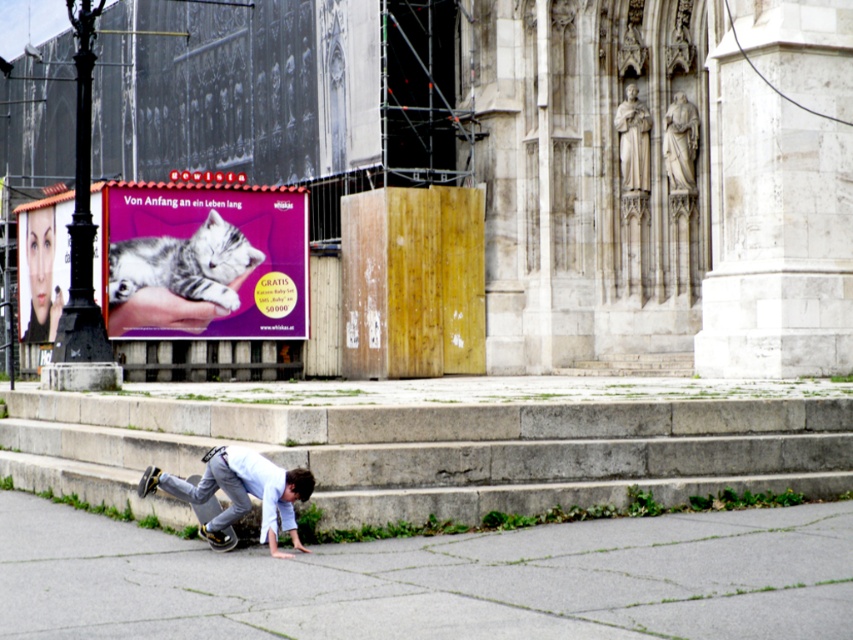
Which is behind, point (421, 460) or point (281, 502)?

Positioned behind is point (421, 460).

Who is lower down, concrete stairs at lower center or light blue denim squat at lower center?

light blue denim squat at lower center

Describe the element at coordinates (436, 451) in the screenshot. I see `concrete stairs at lower center` at that location.

At what (x,y) coordinates should I click in order to perform the action: click on concrete stairs at lower center. Please return your answer as a coordinate pair (x, y). The width and height of the screenshot is (853, 640). Looking at the image, I should click on (436, 451).

Is gray concrete pavement at lower left wider than light blue denim squat at lower center?

Yes.

Who is taller, gray concrete pavement at lower left or light blue denim squat at lower center?

light blue denim squat at lower center

Who is more forward, (717, 584) or (254, 481)?

Positioned in front is point (717, 584).

You are a GUI agent. You are given a task and a screenshot of the screen. Output one action in this format:
    pyautogui.click(x=<x>, y=<y>)
    Task: Click on the gray concrete pavement at lower left
    The image size is (853, 640).
    Given the screenshot: What is the action you would take?
    pyautogui.click(x=434, y=579)

Is concrete stairs at lower center positioned in front of matte purple cat at upper left?

Yes.

The height and width of the screenshot is (640, 853). In order to click on concrete stairs at lower center in this screenshot , I will do `click(436, 451)`.

This screenshot has width=853, height=640. Describe the element at coordinates (436, 451) in the screenshot. I see `concrete stairs at lower center` at that location.

Locate an element on the screen. This screenshot has width=853, height=640. concrete stairs at lower center is located at coordinates (436, 451).